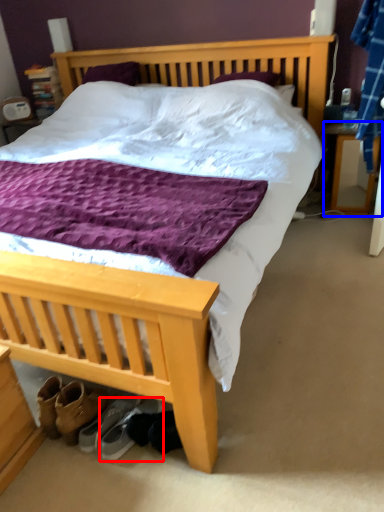
Question: Which object appears farthest to the camera in this image, footwear (highlighted by a red box) or nightstand (highlighted by a blue box)?

Choices:
 (A) footwear
 (B) nightstand

Answer: (B)